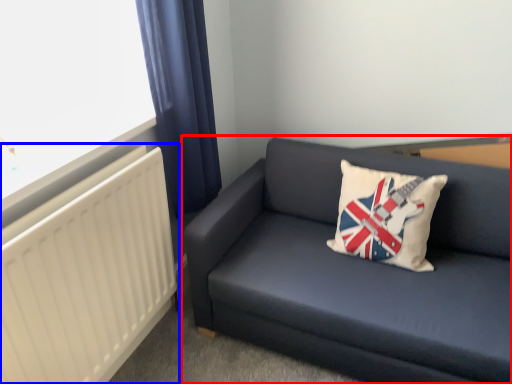
Question: Which of the following is the closest to the observer, studio couch (highlighted by a red box) or radiator (highlighted by a blue box)?

Choices:
 (A) studio couch
 (B) radiator

Answer: (B)